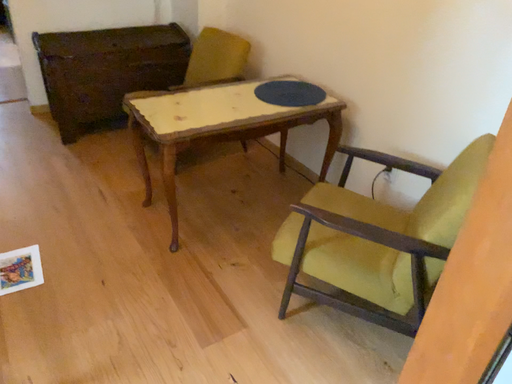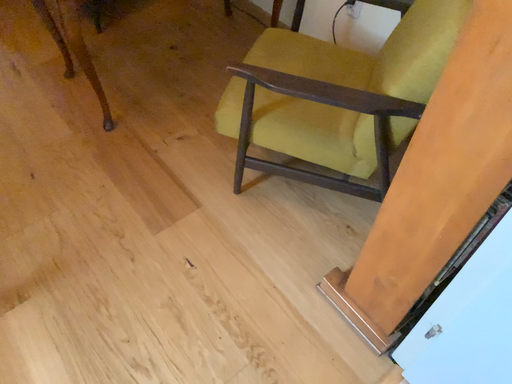
Question: How did the camera likely rotate when shooting the video?

Choices:
 (A) rotated downward
 (B) rotated upward

Answer: (A)